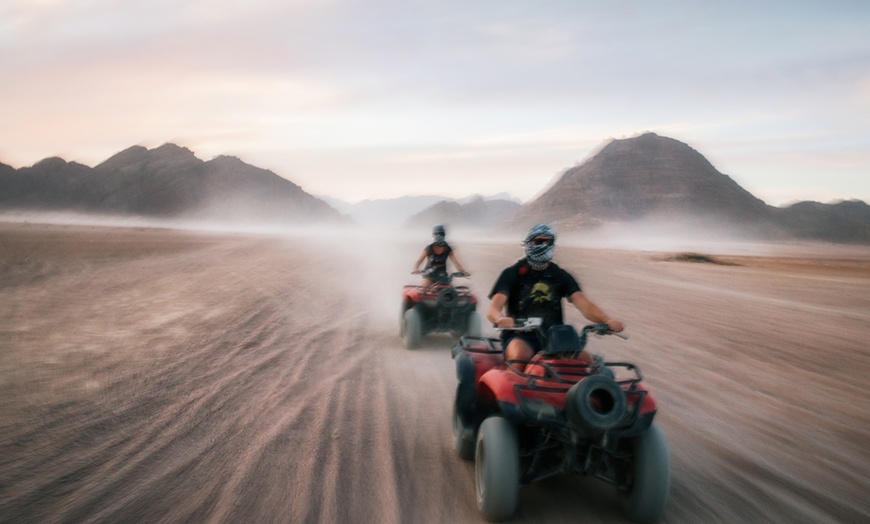
You are a GUI agent. You are given a task and a screenshot of the screen. Output one action in this format:
    pyautogui.click(x=<x>, y=<y>)
    Task: Click on the shades
    The width and height of the screenshot is (870, 524).
    Given the screenshot: What is the action you would take?
    (539, 241), (547, 241)